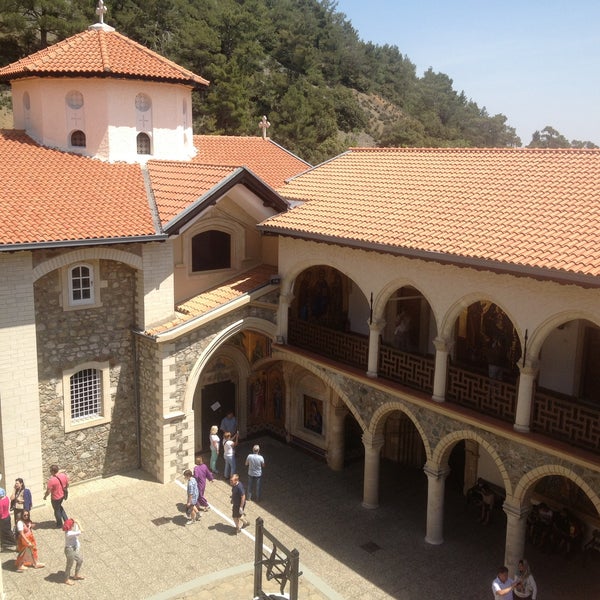
Find the location of a particular element. Image resolution: width=600 pixels, height=600 pixels. doors is located at coordinates (410, 325), (586, 378), (458, 467), (355, 437), (216, 399).